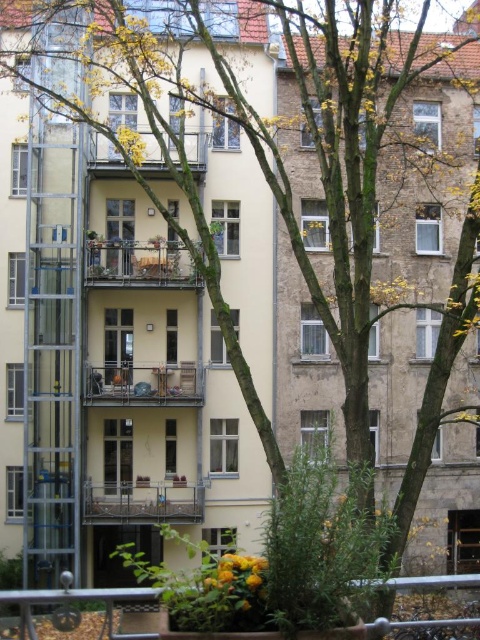
You are standing on the ground floor of the building and looking up at the metallic silver balcony at center and the wooden balcony at upper center. Which balcony appears closer to you?

The metallic silver balcony at center appears closer to you because it is positioned further to the viewer than the wooden balcony at upper center, making it seem nearer in your line of sight.

You are a delivery person trying to place a large package on the balcony. The package is too heavy to lift high. Which balcony, the metallic silver balcony at center or the wooden balcony at upper center, should you choose to place the package?

The metallic silver balcony at center has a larger size compared to wooden balcony at upper center, so you should choose the metallic silver balcony at center to place the package since it can accommodate the large package better.

You are standing at the base of the residential building and want to reach the metallic silver railing at lower center. The elevator is currently out of service. Can you walk directly to the railing from your current position?

The metallic silver railing at lower center is 12.96 meters away from the viewer. Since the elevator is out of service, you would need to walk up the stairs to reach it, but the question specifies walking directly to the railing. Therefore, you cannot walk directly to the railing from your current position as there is a distance of 12.96 meters and the path isn